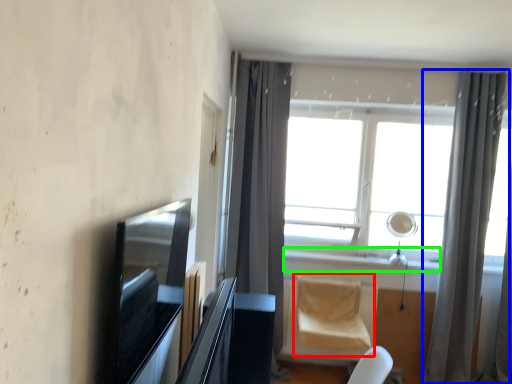
Question: Considering the real-world distances, which object is closest to swivel chair (highlighted by a red box)? curtain (highlighted by a blue box) or window sill (highlighted by a green box).

Choices:
 (A) curtain
 (B) window sill

Answer: (B)